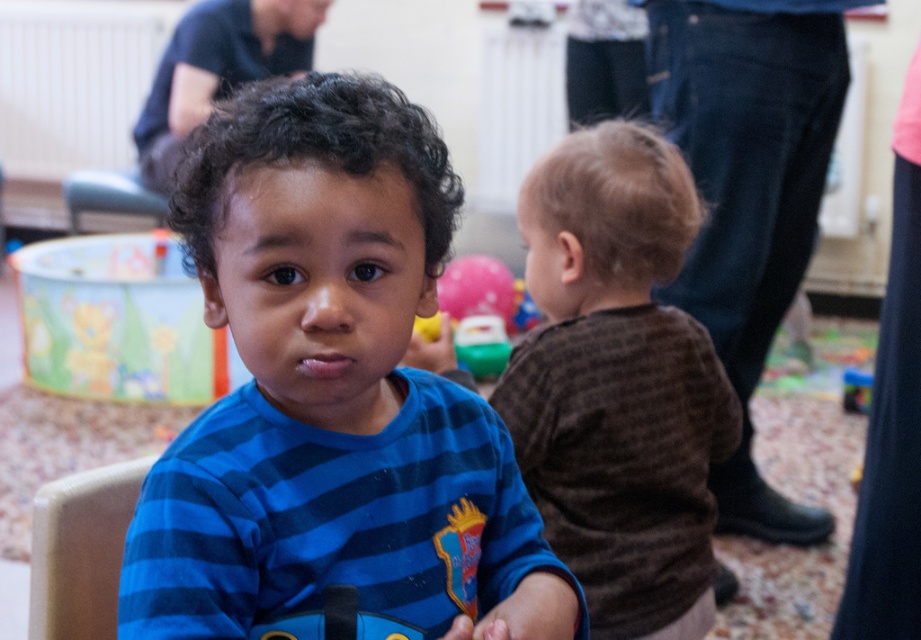
Question: Which point is farther from the camera taking this photo?

Choices:
 (A) (442, 353)
 (B) (701, 484)

Answer: (B)

Question: Is blue striped shirt at center positioned behind brown textured shirt at center?

Choices:
 (A) yes
 (B) no

Answer: (B)

Question: Considering the relative positions of brown textured shirt at center and blue plastic toy at lower right in the image provided, where is brown textured shirt at center located with respect to blue plastic toy at lower right?

Choices:
 (A) below
 (B) above

Answer: (B)

Question: Which point appears farthest from the camera in this image?

Choices:
 (A) (850, 385)
 (B) (500, 275)

Answer: (B)

Question: Does blue striped shirt at center appear on the left side of brown textured shirt at center?

Choices:
 (A) yes
 (B) no

Answer: (A)

Question: Which is nearer to the blue plastic toy at lower right?

Choices:
 (A) brown textured shirt at center
 (B) pink rubber balloon at upper center

Answer: (B)